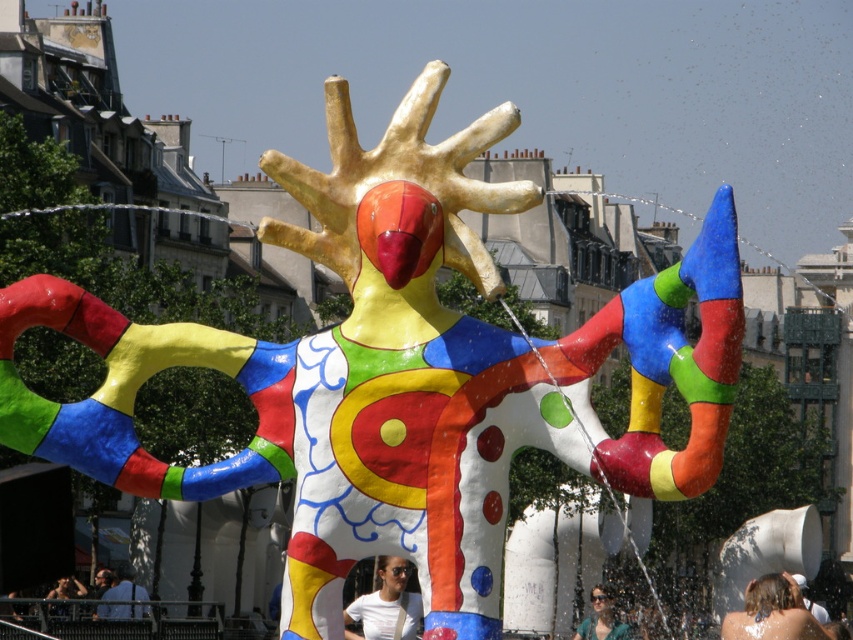
Who is shorter, blonde hair at center or matte white sunglasses at lower center?

Standing shorter between the two is matte white sunglasses at lower center.

Does blonde hair at center come in front of matte white sunglasses at lower center?

Yes, blonde hair at center is in front of matte white sunglasses at lower center.

Find the location of `blonde hair at center`. blonde hair at center is located at coordinates (772, 612).

Which of these two, white matte t-shirt at lower center or denim jacket at lower left, stands taller?

white matte t-shirt at lower center

Is point (378, 560) positioned after point (111, 588)?

That is False.

Identify the location of white matte t-shirt at lower center. (386, 605).

Which is more to the left, denim jacket at lower left or matte white sunglasses at lower center?

From the viewer's perspective, denim jacket at lower left appears more on the left side.

Consider the image. Can you confirm if denim jacket at lower left is positioned to the left of matte white sunglasses at lower center?

Indeed, denim jacket at lower left is positioned on the left side of matte white sunglasses at lower center.

Is point (122, 612) closer to camera compared to point (607, 612)?

Yes.

Find the location of a particular element. denim jacket at lower left is located at coordinates (125, 586).